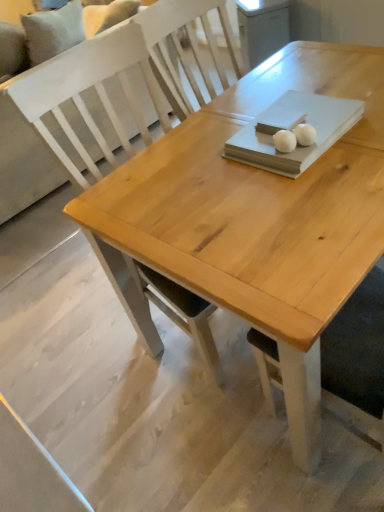
Question: Which direction should I rotate to look at white glossy egg at upper center, arranged as the 1th food when viewed from the right?

Choices:
 (A) left
 (B) right

Answer: (B)

Question: Is white matte ball at center, which is the 1th food in left-to-right order, to the left of natural wood table at center from the viewer's perspective?

Choices:
 (A) no
 (B) yes

Answer: (A)

Question: Is the position of white matte ball at center, the second food viewed from the right, more distant than that of natural wood table at center?

Choices:
 (A) no
 (B) yes

Answer: (B)

Question: Is white matte ball at center, which is the 1th food in left-to-right order, next to natural wood table at center?

Choices:
 (A) yes
 (B) no

Answer: (B)

Question: Can you confirm if white matte ball at center, the second food viewed from the right, is shorter than natural wood table at center?

Choices:
 (A) no
 (B) yes

Answer: (B)

Question: From the image's perspective, is white matte ball at center, the second food viewed from the right, under natural wood table at center?

Choices:
 (A) yes
 (B) no

Answer: (A)

Question: From a real-world perspective, does white matte ball at center, the second food viewed from the right, sit lower than natural wood table at center?

Choices:
 (A) yes
 (B) no

Answer: (B)

Question: Is natural wood table at center surrounded by white fabric couch at upper left?

Choices:
 (A) no
 (B) yes

Answer: (A)

Question: Considering the relative sizes of white fabric couch at upper left and natural wood table at center in the image provided, is white fabric couch at upper left bigger than natural wood table at center?

Choices:
 (A) yes
 (B) no

Answer: (A)

Question: Could you tell me if white fabric couch at upper left is turned towards natural wood table at center?

Choices:
 (A) no
 (B) yes

Answer: (A)

Question: Is white fabric couch at upper left not inside natural wood table at center?

Choices:
 (A) no
 (B) yes

Answer: (B)

Question: Can you confirm if white fabric couch at upper left is positioned to the left of natural wood table at center?

Choices:
 (A) yes
 (B) no

Answer: (A)

Question: From a real-world perspective, is white fabric couch at upper left located higher than natural wood table at center?

Choices:
 (A) no
 (B) yes

Answer: (B)

Question: Is white fabric couch at upper left facing away from white matte ball at center, the second food viewed from the right?

Choices:
 (A) no
 (B) yes

Answer: (B)